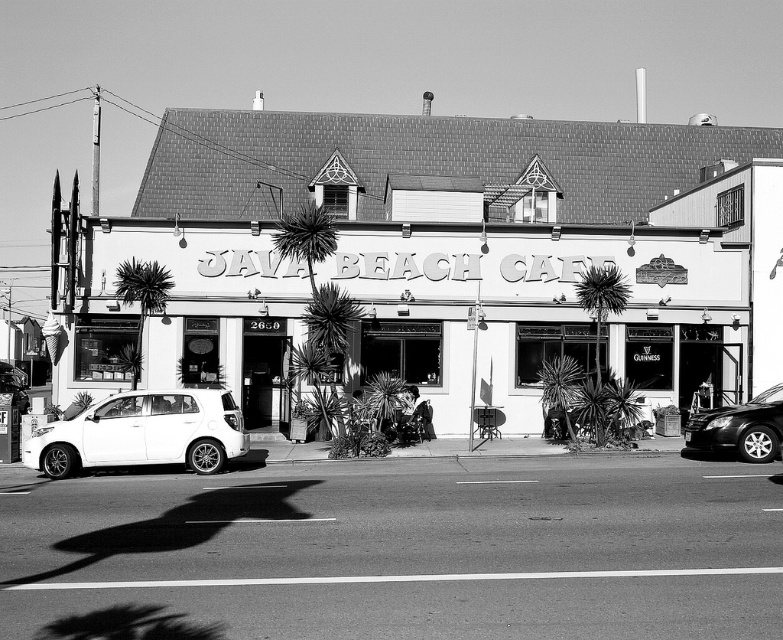
Question: Can you confirm if white matte hatchback at lower left is thinner than shiny black sedan at right?

Choices:
 (A) yes
 (B) no

Answer: (B)

Question: Which of the following is the closest to the observer?

Choices:
 (A) dark green leafy palm tree at center
 (B) dark green leafy palm tree at left
 (C) white matte hatchback at lower left
 (D) shiny black sedan at right

Answer: (C)

Question: Is thick green palm tree at center smaller than dark green leafy palm tree at center?

Choices:
 (A) no
 (B) yes

Answer: (A)

Question: Is white matte hatchback at lower left further to camera compared to dark green leafy palm tree at center?

Choices:
 (A) yes
 (B) no

Answer: (B)

Question: Which point is closer to the camera?

Choices:
 (A) click(572, 253)
 (B) click(136, 353)

Answer: (B)

Question: Which of the following is the farthest from the observer?

Choices:
 (A) (565, 390)
 (B) (525, 326)

Answer: (B)